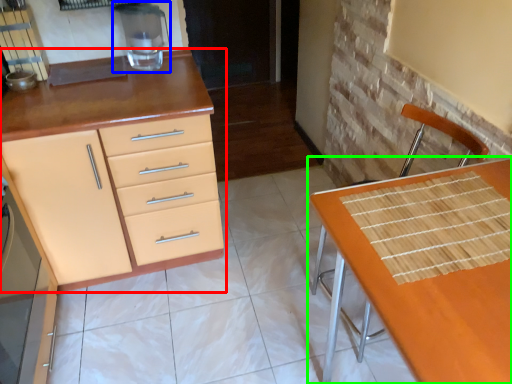
Question: Based on their relative distances, which object is farther from cabinetry (highlighted by a red box)? Choose from appliance (highlighted by a blue box) and table (highlighted by a green box).

Choices:
 (A) appliance
 (B) table

Answer: (B)